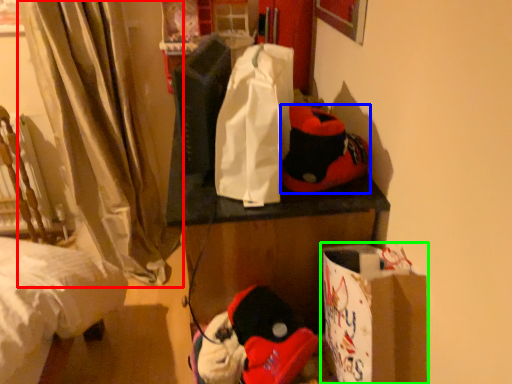
Question: Considering the real-world distances, which object is farthest from curtain (highlighted by a red box)? twin (highlighted by a blue box) or cardboard box (highlighted by a green box)?

Choices:
 (A) twin
 (B) cardboard box

Answer: (B)